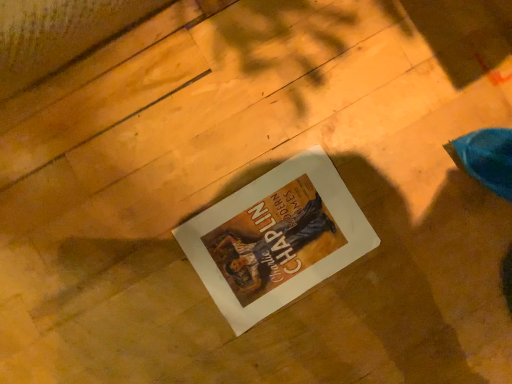
Where is `free spot to the right of matte paper poster at center`? The width and height of the screenshot is (512, 384). free spot to the right of matte paper poster at center is located at coordinates click(x=373, y=314).